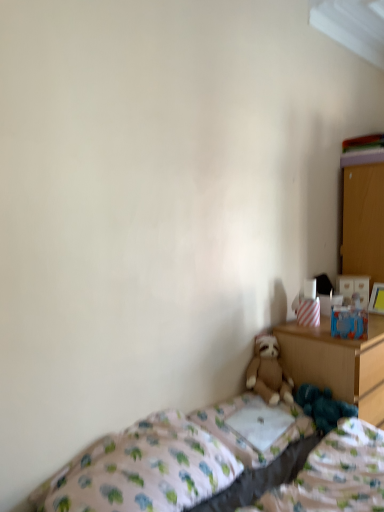
Question: Does patterned fabric bed at lower right lie in front of wooden dresser at right?

Choices:
 (A) yes
 (B) no

Answer: (A)

Question: Is patterned fabric bed at lower right smaller than wooden dresser at right?

Choices:
 (A) yes
 (B) no

Answer: (A)

Question: From the image's perspective, is patterned fabric bed at lower right above wooden dresser at right?

Choices:
 (A) no
 (B) yes

Answer: (A)

Question: Is patterned fabric bed at lower right touching wooden dresser at right?

Choices:
 (A) no
 (B) yes

Answer: (A)

Question: Is patterned fabric bed at lower right positioned behind wooden dresser at right?

Choices:
 (A) yes
 (B) no

Answer: (B)

Question: Does point (253, 441) appear closer or farther from the camera than point (306, 395)?

Choices:
 (A) farther
 (B) closer

Answer: (B)

Question: Relative to dark blue plush at lower right, is white fabric pillow at center in front or behind?

Choices:
 (A) front
 (B) behind

Answer: (A)

Question: Is white fabric pillow at center inside or outside of dark blue plush at lower right?

Choices:
 (A) inside
 (B) outside

Answer: (B)

Question: From a real-world perspective, is white fabric pillow at center positioned above or below dark blue plush at lower right?

Choices:
 (A) below
 (B) above

Answer: (A)

Question: Considering their positions, is dark blue plush at lower right located in front of or behind wooden nightstand at right?

Choices:
 (A) front
 (B) behind

Answer: (A)

Question: From the image's perspective, relative to wooden nightstand at right, is dark blue plush at lower right above or below?

Choices:
 (A) below
 (B) above

Answer: (B)

Question: Is dark blue plush at lower right to the left or to the right of wooden nightstand at right in the image?

Choices:
 (A) right
 (B) left

Answer: (B)

Question: Choose the correct answer: Is dark blue plush at lower right inside wooden nightstand at right or outside it?

Choices:
 (A) inside
 (B) outside

Answer: (B)

Question: Is point (296, 394) positioned closer to the camera than point (273, 408)?

Choices:
 (A) closer
 (B) farther

Answer: (B)

Question: From the image's perspective, is dark blue plush at lower right located above or below white fabric pillow at center?

Choices:
 (A) above
 (B) below

Answer: (A)